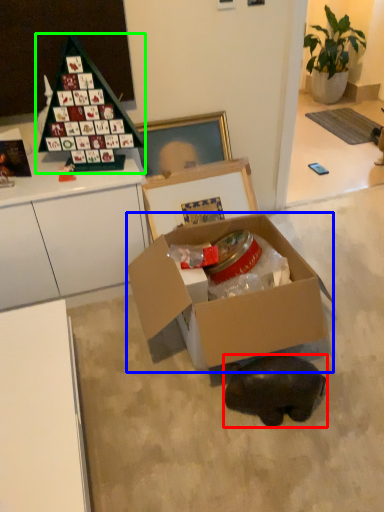
Question: Which is farther away from animal (highlighted by a red box)? box (highlighted by a blue box) or toy (highlighted by a green box)?

Choices:
 (A) box
 (B) toy

Answer: (B)